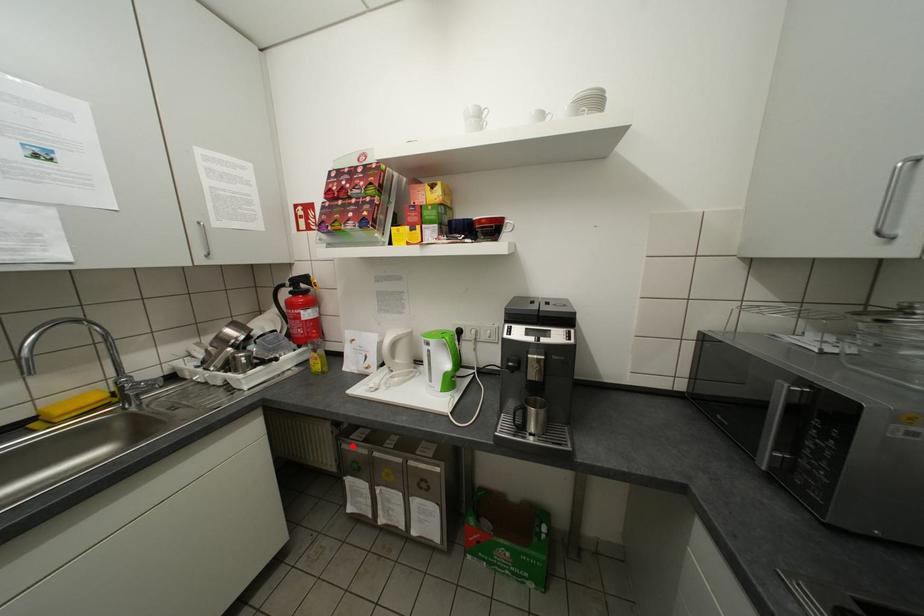
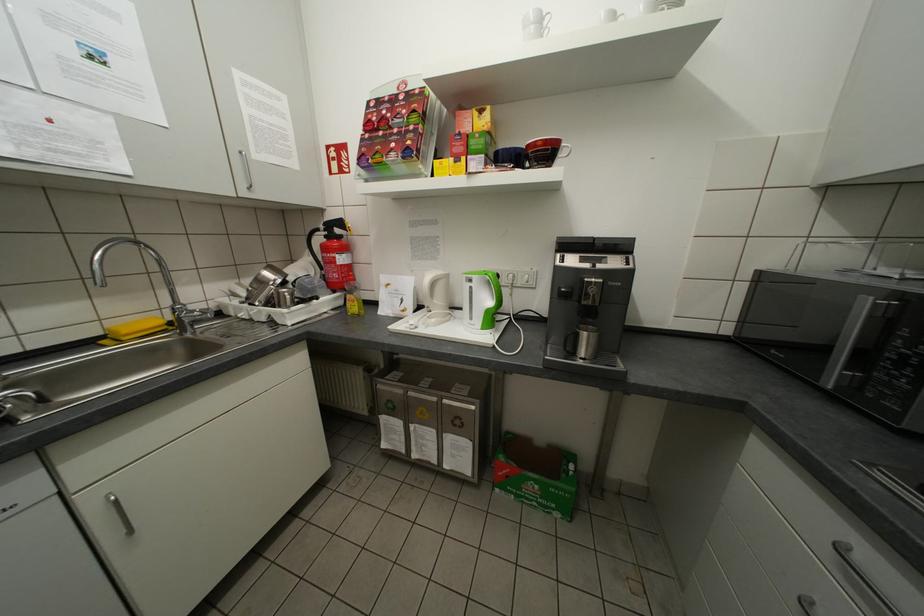
Question: I am providing you with two images of the same scene from different viewpoints. Image1 has a red point marked. In image2, the corresponding 3D location appears at what relative position? Reply with the corresponding letter.

Choices:
 (A) Closer
 (B) Farther

Answer: (A)